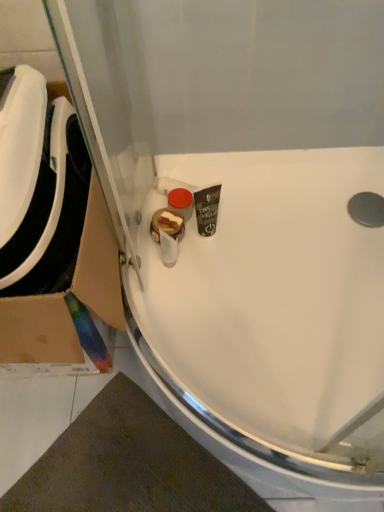
Question: Is point (261, 237) positioned closer to the camera than point (94, 237)?

Choices:
 (A) closer
 (B) farther

Answer: (B)

Question: In the image, is white glossy sink at center, marked as the 2th sink in a left-to-right arrangement, on the left side or the right side of cardboard at left?

Choices:
 (A) right
 (B) left

Answer: (A)

Question: Considering the real-world distances, which object is closest to the cardboard at left?

Choices:
 (A) white glossy sink at left, which ranks as the 2th sink in right-to-left order
 (B) white glossy sink at center, marked as the 2th sink in a left-to-right arrangement

Answer: (A)

Question: Considering the real-world distances, which object is farthest from the white glossy sink at left, which ranks as the 2th sink in right-to-left order?

Choices:
 (A) cardboard at left
 (B) white glossy sink at center, acting as the first sink starting from the right

Answer: (B)